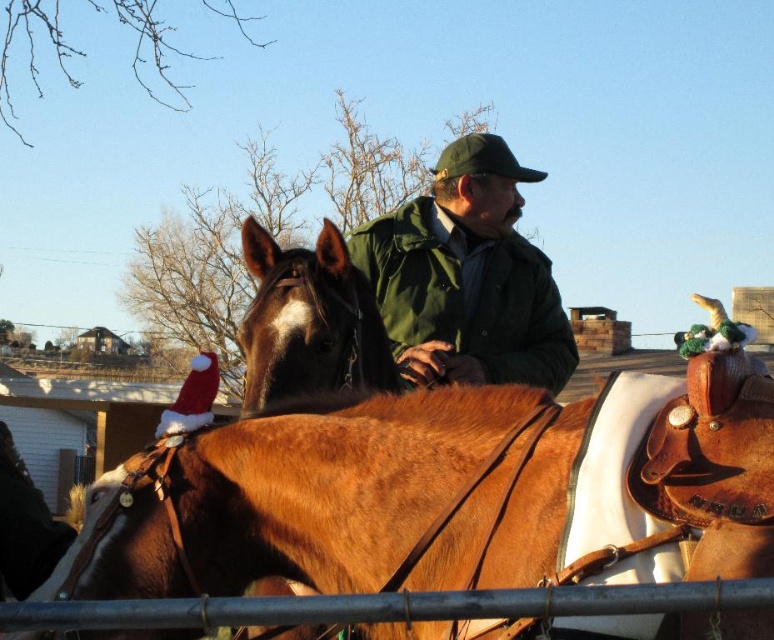
You are a rider trying to adjust the position of your gear. You have a brown leather saddle at center and a brown leather horse at center in front of you. Which object is closer to you when you are sitting on the horse?

The brown leather saddle at center is closer to you because it is positioned in front of the brown leather horse at center, meaning it is nearer to your seated position.

In the scene shown: You are a photographer trying to capture the man and his horse. You want to ensure that both the brown leather saddle at center and the green matte jacket at center are visible in your photo. Based on their positions, which object should appear lower in the image?

The brown leather saddle at center is positioned below the green matte jacket at center, so it will appear lower in the image.